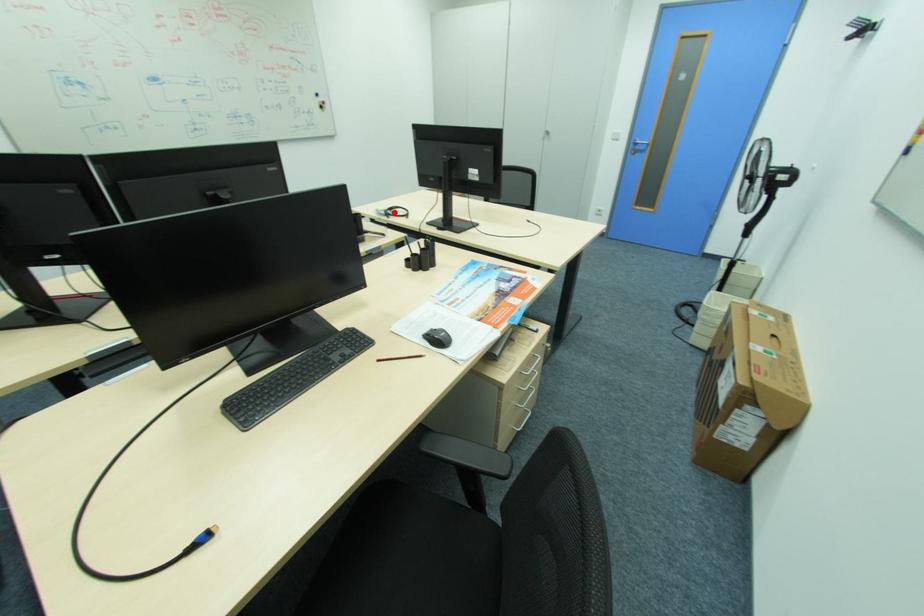
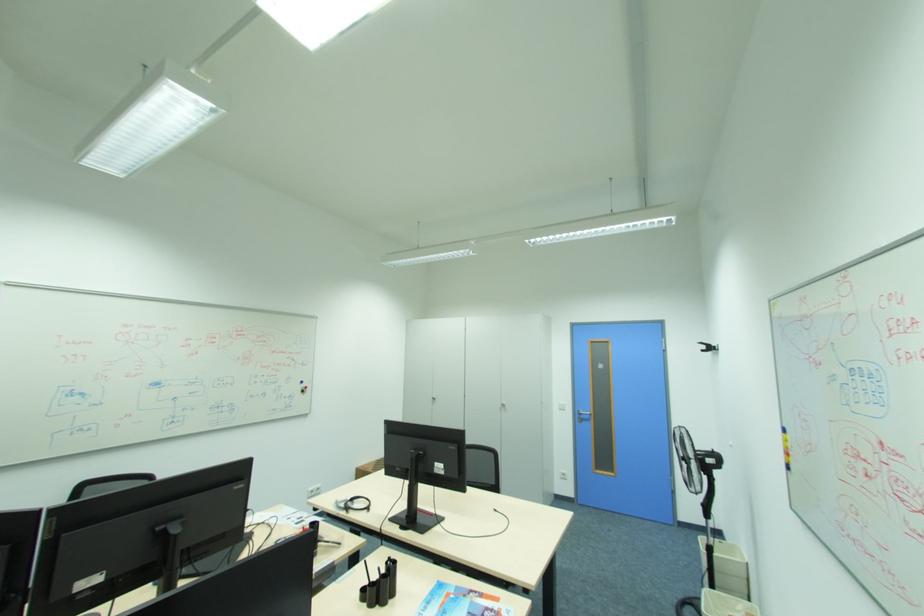
Question: I am providing you with two images of the same scene from different viewpoints. In image1, a red point is highlighted. Considering the same 3D point in image2, which of the following is correct?

Choices:
 (A) It is closer
 (B) It is farther

Answer: (A)